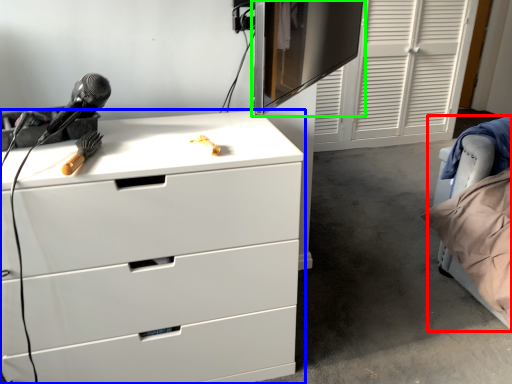
Question: Based on their relative distances, which object is nearer to bed (highlighted by a red box)? Choose from chest of drawers (highlighted by a blue box) and computer monitor (highlighted by a green box).

Choices:
 (A) chest of drawers
 (B) computer monitor

Answer: (A)